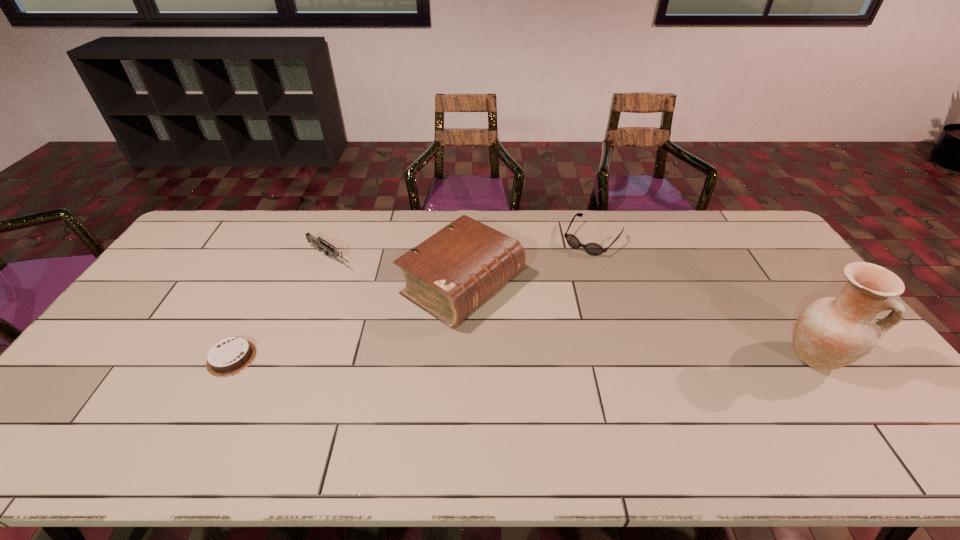
Choose which object is the second nearest neighbor to the sunglasses. Please provide its 2D coordinates. Your answer should be formatted as a tuple, i.e. [(x, y)], where the tuple contains the x and y coordinates of a point satisfying the conditions above.

[(831, 332)]

The width and height of the screenshot is (960, 540). What are the coordinates of `vacant position in the image that satisfies the following two spatial constraints: 1. on the front side of the pottery; 2. on the left side of the leftmost object` in the screenshot? It's located at (231, 358).

You are a GUI agent. You are given a task and a screenshot of the screen. Output one action in this format:
    pyautogui.click(x=<x>, y=<y>)
    Task: Click on the vacant position in the image that satisfies the following two spatial constraints: 1. on the front side of the fourth shortest object; 2. on the left side of the rightmost object
    The width and height of the screenshot is (960, 540).
    Given the screenshot: What is the action you would take?
    pyautogui.click(x=459, y=358)

Find the location of a particular element. The height and width of the screenshot is (540, 960). vacant position in the image that satisfies the following two spatial constraints: 1. on the front side of the chocolate cake; 2. on the right side of the tallest object is located at coordinates (231, 358).